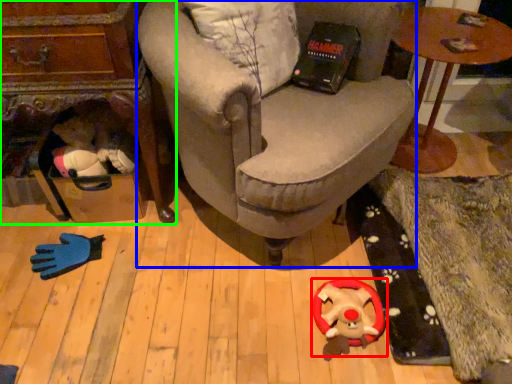
Question: Which object is positioned closest to toy (highlighted by a red box)? Select from chair (highlighted by a blue box) and table (highlighted by a green box).

Choices:
 (A) chair
 (B) table

Answer: (A)